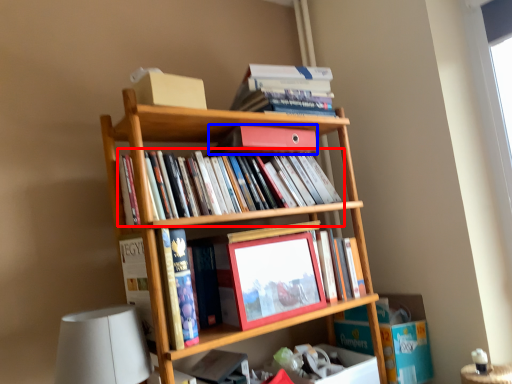
Question: Which point is closer to the camera, book (highlighted by a red box) or book (highlighted by a blue box)?

Choices:
 (A) book
 (B) book

Answer: (A)